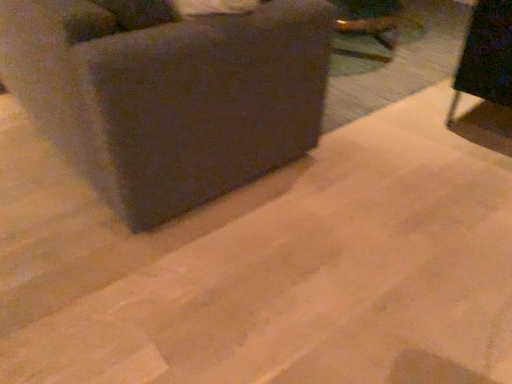
What do you see at coordinates (168, 94) in the screenshot?
I see `dark fabric couch at upper left, the 1th furniture from the left` at bounding box center [168, 94].

The image size is (512, 384). I want to click on dark fabric couch at upper left, placed as the 2th furniture when sorted from right to left, so click(x=168, y=94).

Where is `black fabric chair at upper right, positioned as the 2th furniture in left-to-right order`? black fabric chair at upper right, positioned as the 2th furniture in left-to-right order is located at coordinates tap(486, 76).

Measure the distance between point (488, 129) and camera.

They are 2.25 meters apart.

Describe the element at coordinates (486, 76) in the screenshot. The image size is (512, 384). I see `black fabric chair at upper right, positioned as the 2th furniture in left-to-right order` at that location.

The height and width of the screenshot is (384, 512). In order to click on dark fabric couch at upper left, the 1th furniture from the left in this screenshot , I will do `click(168, 94)`.

Considering the positions of objects dark fabric couch at upper left, placed as the 2th furniture when sorted from right to left, and black fabric chair at upper right, the first furniture from the right, in the image provided, who is more to the right, dark fabric couch at upper left, placed as the 2th furniture when sorted from right to left, or black fabric chair at upper right, the first furniture from the right,?

A: From the viewer's perspective, black fabric chair at upper right, the first furniture from the right, appears more on the right side.

Considering the positions of objects dark fabric couch at upper left, placed as the 2th furniture when sorted from right to left, and black fabric chair at upper right, positioned as the 2th furniture in left-to-right order, in the image provided, who is in front, dark fabric couch at upper left, placed as the 2th furniture when sorted from right to left, or black fabric chair at upper right, positioned as the 2th furniture in left-to-right order,?

dark fabric couch at upper left, placed as the 2th furniture when sorted from right to left, is closer to the camera.

Is point (289, 100) farther from camera compared to point (498, 21)?

No, it is in front of (498, 21).

From the image's perspective, is dark fabric couch at upper left, the 1th furniture from the left, on top of black fabric chair at upper right, the first furniture from the right?

Correct, dark fabric couch at upper left, the 1th furniture from the left, appears higher than black fabric chair at upper right, the first furniture from the right, in the image.

From a real-world perspective, relative to black fabric chair at upper right, the first furniture from the right, is dark fabric couch at upper left, the 1th furniture from the left, vertically above or below?

In terms of real-world spatial position, dark fabric couch at upper left, the 1th furniture from the left, is above black fabric chair at upper right, the first furniture from the right.

In terms of width, does dark fabric couch at upper left, placed as the 2th furniture when sorted from right to left, look wider or thinner when compared to black fabric chair at upper right, the first furniture from the right?

Considering their sizes, dark fabric couch at upper left, placed as the 2th furniture when sorted from right to left, looks broader than black fabric chair at upper right, the first furniture from the right.

Consider the image. From their relative heights in the image, would you say dark fabric couch at upper left, placed as the 2th furniture when sorted from right to left, is taller or shorter than black fabric chair at upper right, the first furniture from the right?

Considering their sizes, dark fabric couch at upper left, placed as the 2th furniture when sorted from right to left, has more height than black fabric chair at upper right, the first furniture from the right.

Based on their sizes in the image, would you say dark fabric couch at upper left, the 1th furniture from the left, is bigger or smaller than black fabric chair at upper right, the first furniture from the right?

Clearly, dark fabric couch at upper left, the 1th furniture from the left, is larger in size than black fabric chair at upper right, the first furniture from the right.

Is black fabric chair at upper right, the first furniture from the right, completely or partially inside dark fabric couch at upper left, placed as the 2th furniture when sorted from right to left?

No, black fabric chair at upper right, the first furniture from the right, is not inside dark fabric couch at upper left, placed as the 2th furniture when sorted from right to left.

Is dark fabric couch at upper left, the 1th furniture from the left, far away from black fabric chair at upper right, the first furniture from the right?

Yes, dark fabric couch at upper left, the 1th furniture from the left, and black fabric chair at upper right, the first furniture from the right, are quite far apart.

Is dark fabric couch at upper left, placed as the 2th furniture when sorted from right to left, facing towards black fabric chair at upper right, the first furniture from the right?

Yes, dark fabric couch at upper left, placed as the 2th furniture when sorted from right to left, faces towards black fabric chair at upper right, the first furniture from the right.

Can you tell me how much dark fabric couch at upper left, the 1th furniture from the left, and black fabric chair at upper right, positioned as the 2th furniture in left-to-right order, differ in facing direction?

The angle between the facing direction of dark fabric couch at upper left, the 1th furniture from the left, and the facing direction of black fabric chair at upper right, positioned as the 2th furniture in left-to-right order, is 88.6 degrees.

How far apart are dark fabric couch at upper left, placed as the 2th furniture when sorted from right to left, and black fabric chair at upper right, positioned as the 2th furniture in left-to-right order?

The distance of dark fabric couch at upper left, placed as the 2th furniture when sorted from right to left, from black fabric chair at upper right, positioned as the 2th furniture in left-to-right order, is 4.18 feet.

Where is `furniture located on the left of black fabric chair at upper right, positioned as the 2th furniture in left-to-right order`? The height and width of the screenshot is (384, 512). furniture located on the left of black fabric chair at upper right, positioned as the 2th furniture in left-to-right order is located at coordinates (168, 94).

Based on their positions, is black fabric chair at upper right, positioned as the 2th furniture in left-to-right order, located to the left or right of dark fabric couch at upper left, placed as the 2th furniture when sorted from right to left?

black fabric chair at upper right, positioned as the 2th furniture in left-to-right order, is positioned on dark fabric couch at upper left, placed as the 2th furniture when sorted from right to left,'s right side.

Considering the positions of objects black fabric chair at upper right, positioned as the 2th furniture in left-to-right order, and dark fabric couch at upper left, placed as the 2th furniture when sorted from right to left, in the image provided, who is in front, black fabric chair at upper right, positioned as the 2th furniture in left-to-right order, or dark fabric couch at upper left, placed as the 2th furniture when sorted from right to left,?

dark fabric couch at upper left, placed as the 2th furniture when sorted from right to left.

Considering the positions of point (486, 90) and point (137, 122), is point (486, 90) closer or farther from the camera than point (137, 122)?

Point (486, 90).

From the image's perspective, is black fabric chair at upper right, the first furniture from the right, over dark fabric couch at upper left, the 1th furniture from the left?

No, from the image's perspective, black fabric chair at upper right, the first furniture from the right, is not on top of dark fabric couch at upper left, the 1th furniture from the left.

From a real-world perspective, is black fabric chair at upper right, positioned as the 2th furniture in left-to-right order, positioned over dark fabric couch at upper left, the 1th furniture from the left, based on gravity?

No, from a real-world perspective, black fabric chair at upper right, positioned as the 2th furniture in left-to-right order, is not over dark fabric couch at upper left, the 1th furniture from the left

Is black fabric chair at upper right, positioned as the 2th furniture in left-to-right order, thinner than dark fabric couch at upper left, placed as the 2th furniture when sorted from right to left?

Yes.

Considering the sizes of black fabric chair at upper right, positioned as the 2th furniture in left-to-right order, and dark fabric couch at upper left, the 1th furniture from the left, in the image, is black fabric chair at upper right, positioned as the 2th furniture in left-to-right order, taller or shorter than dark fabric couch at upper left, the 1th furniture from the left,?

In the image, black fabric chair at upper right, positioned as the 2th furniture in left-to-right order, appears to be shorter than dark fabric couch at upper left, the 1th furniture from the left.

Between black fabric chair at upper right, positioned as the 2th furniture in left-to-right order, and dark fabric couch at upper left, placed as the 2th furniture when sorted from right to left, which one has larger size?

Bigger between the two is dark fabric couch at upper left, placed as the 2th furniture when sorted from right to left.

Is black fabric chair at upper right, the first furniture from the right, situated inside dark fabric couch at upper left, placed as the 2th furniture when sorted from right to left, or outside?

black fabric chair at upper right, the first furniture from the right, lies outside dark fabric couch at upper left, placed as the 2th furniture when sorted from right to left.

Is black fabric chair at upper right, the first furniture from the right, oriented towards dark fabric couch at upper left, the 1th furniture from the left?

No, black fabric chair at upper right, the first furniture from the right, is not turned towards dark fabric couch at upper left, the 1th furniture from the left.

Could you measure the distance between black fabric chair at upper right, positioned as the 2th furniture in left-to-right order, and dark fabric couch at upper left, placed as the 2th furniture when sorted from right to left?

black fabric chair at upper right, positioned as the 2th furniture in left-to-right order, and dark fabric couch at upper left, placed as the 2th furniture when sorted from right to left, are 4.18 feet apart.

Find the location of a particular element. furniture lying above the black fabric chair at upper right, the first furniture from the right (from the image's perspective) is located at coordinates (168, 94).

This screenshot has height=384, width=512. Identify the location of furniture that is behind the dark fabric couch at upper left, placed as the 2th furniture when sorted from right to left. (486, 76).

At what (x,y) coordinates should I click in order to perform the action: click on furniture on the right of dark fabric couch at upper left, placed as the 2th furniture when sorted from right to left. Please return your answer as a coordinate pair (x, y). Looking at the image, I should click on (486, 76).